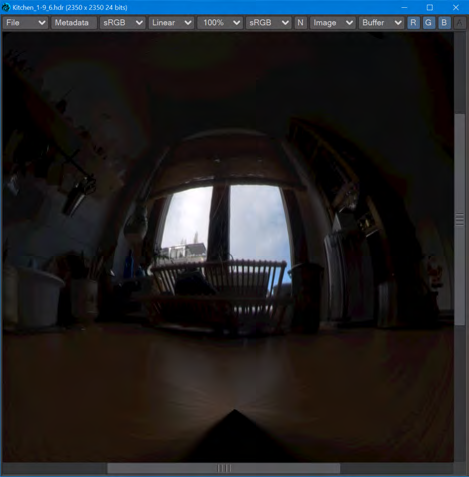
Find the location of a particular element. The image size is (469, 477). wall is located at coordinates pyautogui.click(x=71, y=242).